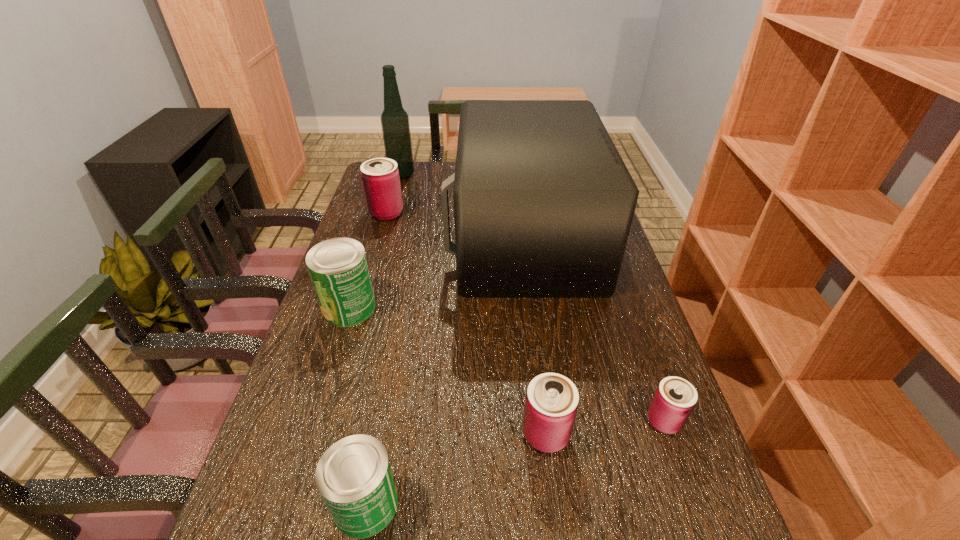
In the image, there is a desktop. Where is `vacant space at the left edge`? This screenshot has width=960, height=540. vacant space at the left edge is located at coordinates (334, 401).

You are a GUI agent. You are given a task and a screenshot of the screen. Output one action in this format:
    pyautogui.click(x=<x>, y=<y>)
    Task: Click on the free space at the right edge of the desktop
    
    Given the screenshot: What is the action you would take?
    pyautogui.click(x=630, y=403)

Identify the location of free area in between the smallest pink can and the biggest pink can. The width and height of the screenshot is (960, 540). (525, 317).

You are a GUI agent. You are given a task and a screenshot of the screen. Output one action in this format:
    pyautogui.click(x=<x>, y=<y>)
    Task: Click on the free point between the farthest pink can and the second tallest object
    This screenshot has height=540, width=960.
    Given the screenshot: What is the action you would take?
    pyautogui.click(x=455, y=225)

Locate an element on the screen. This screenshot has height=540, width=960. vacant space that's between the rightmost can and the right green can is located at coordinates (516, 463).

Where is `vacant region between the right green can and the rightmost pink can`? This screenshot has width=960, height=540. vacant region between the right green can and the rightmost pink can is located at coordinates (516, 463).

Find the location of a particular element. vacant area that lies between the biggest pink can and the second smallest pink can is located at coordinates (466, 323).

You are a GUI agent. You are given a task and a screenshot of the screen. Output one action in this format:
    pyautogui.click(x=<x>, y=<y>)
    Task: Click on the free space between the second biggest pink can and the right green can
    
    Given the screenshot: What is the action you would take?
    pyautogui.click(x=456, y=469)

Where is `object that is the sixth nearest to the farthest pink can`? This screenshot has width=960, height=540. object that is the sixth nearest to the farthest pink can is located at coordinates (675, 398).

Select which object appears as the fourth closest to the nearest object. Please provide its 2D coordinates. Your answer should be formatted as a tuple, i.e. [(x, y)], where the tuple contains the x and y coordinates of a point satisfying the conditions above.

[(675, 398)]